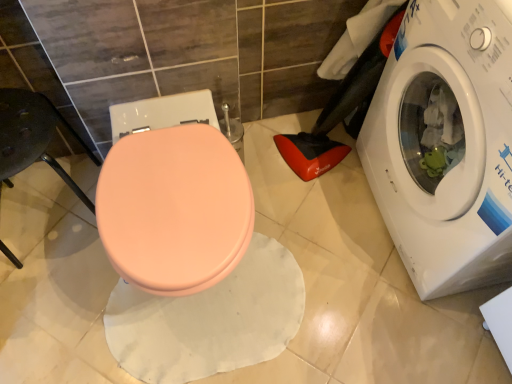
Question: Is white glossy washing machine at right far from matte pink seat at left?

Choices:
 (A) yes
 (B) no

Answer: (A)

Question: Does white glossy washing machine at right have a greater width compared to matte pink seat at left?

Choices:
 (A) yes
 (B) no

Answer: (A)

Question: From a real-world perspective, is white glossy washing machine at right located higher than matte pink seat at left?

Choices:
 (A) no
 (B) yes

Answer: (B)

Question: Does white glossy washing machine at right have a larger size compared to matte pink seat at left?

Choices:
 (A) yes
 (B) no

Answer: (A)

Question: Is white glossy washing machine at right to the left of matte pink seat at left from the viewer's perspective?

Choices:
 (A) no
 (B) yes

Answer: (A)

Question: Does white glossy washing machine at right appear on the right side of matte pink seat at left?

Choices:
 (A) yes
 (B) no

Answer: (A)

Question: Can you see matte pink seat at left touching white glossy washing machine at right?

Choices:
 (A) yes
 (B) no

Answer: (B)

Question: Is matte pink seat at left positioned with its back to white glossy washing machine at right?

Choices:
 (A) no
 (B) yes

Answer: (A)

Question: Is matte pink seat at left far from white glossy washing machine at right?

Choices:
 (A) no
 (B) yes

Answer: (B)

Question: Does matte pink seat at left appear on the left side of white glossy washing machine at right?

Choices:
 (A) no
 (B) yes

Answer: (B)

Question: Is the position of matte pink seat at left more distant than that of white glossy washing machine at right?

Choices:
 (A) no
 (B) yes

Answer: (B)

Question: Is white glossy washing machine at right inside matte pink seat at left?

Choices:
 (A) no
 (B) yes

Answer: (A)

Question: Considering the relative sizes of matte pink bidet at center and white glossy washing machine at right in the image provided, is matte pink bidet at center smaller than white glossy washing machine at right?

Choices:
 (A) yes
 (B) no

Answer: (A)